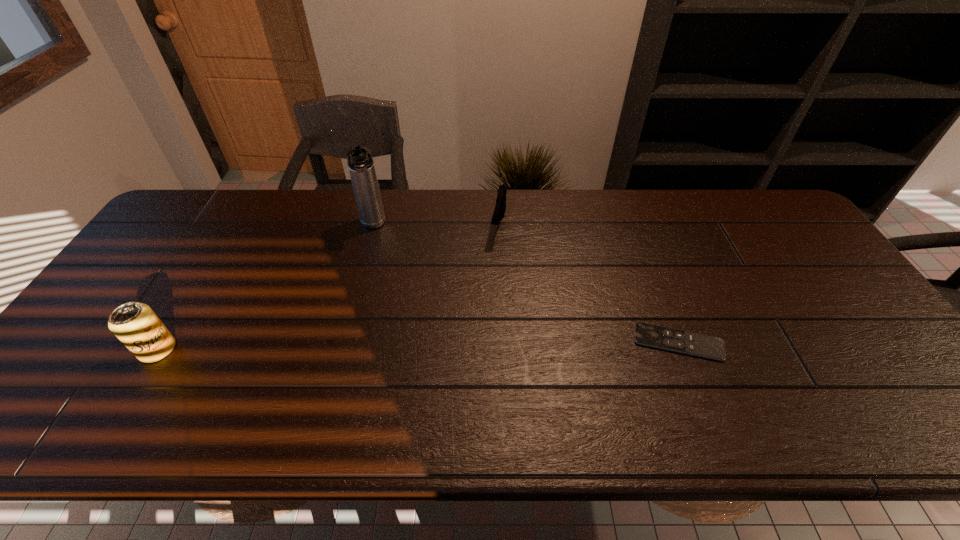
At what (x,y) coordinates should I click in order to perform the action: click on vacant region that satisfies the following two spatial constraints: 1. on the front side of the thermos bottle; 2. on the right side of the remote control. Please return your answer as a coordinate pair (x, y). Looking at the image, I should click on (342, 342).

Image resolution: width=960 pixels, height=540 pixels. What are the coordinates of `vacant position in the image that satisfies the following two spatial constraints: 1. on the front side of the third tallest object; 2. on the right side of the remote control` in the screenshot? It's located at (504, 342).